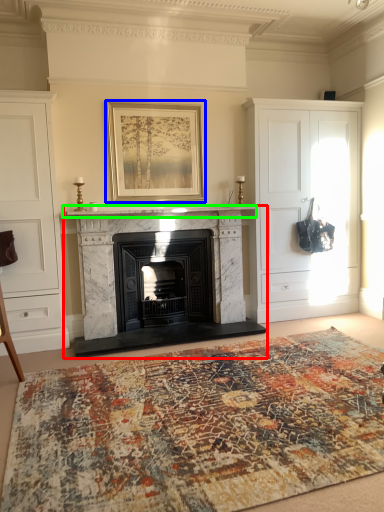
Question: Which object is the closest to the fireplace (highlighted by a red box)? Choose among these: picture frame (highlighted by a blue box) or mantle (highlighted by a green box).

Choices:
 (A) picture frame
 (B) mantle

Answer: (B)